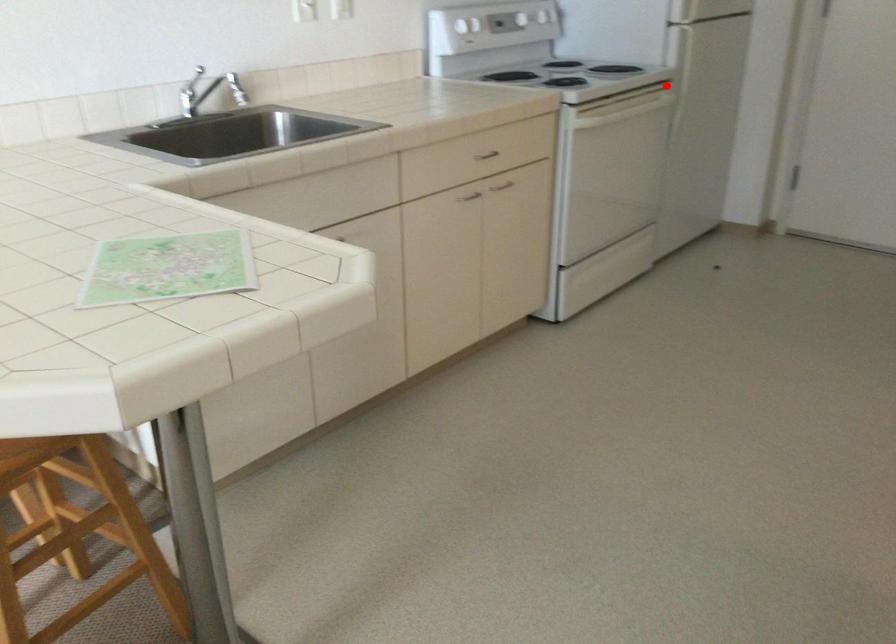
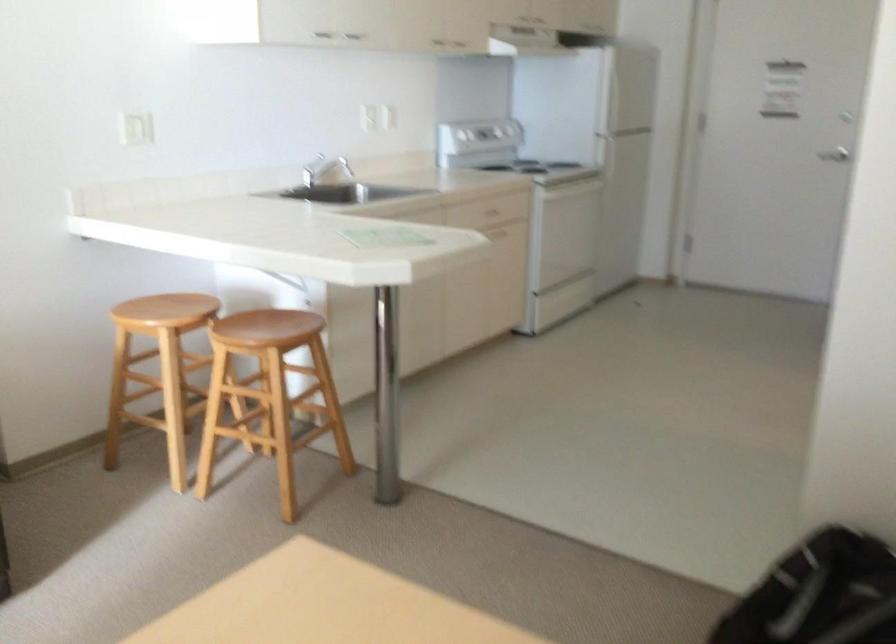
Question: I am providing you with two images of the same scene from different viewpoints. A red point is marked on the first image. Is the red point's position out of view in image 2?

Choices:
 (A) Yes
 (B) No

Answer: (B)